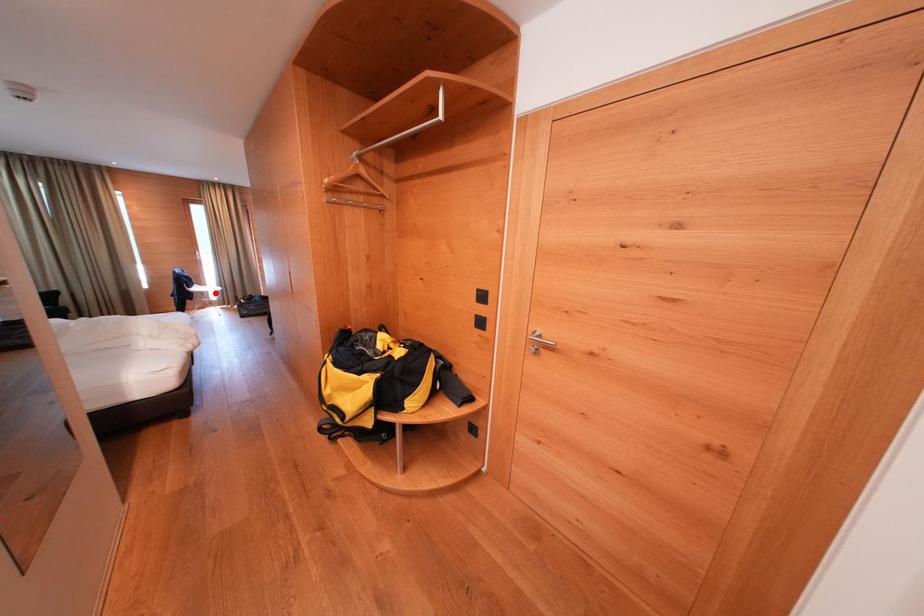
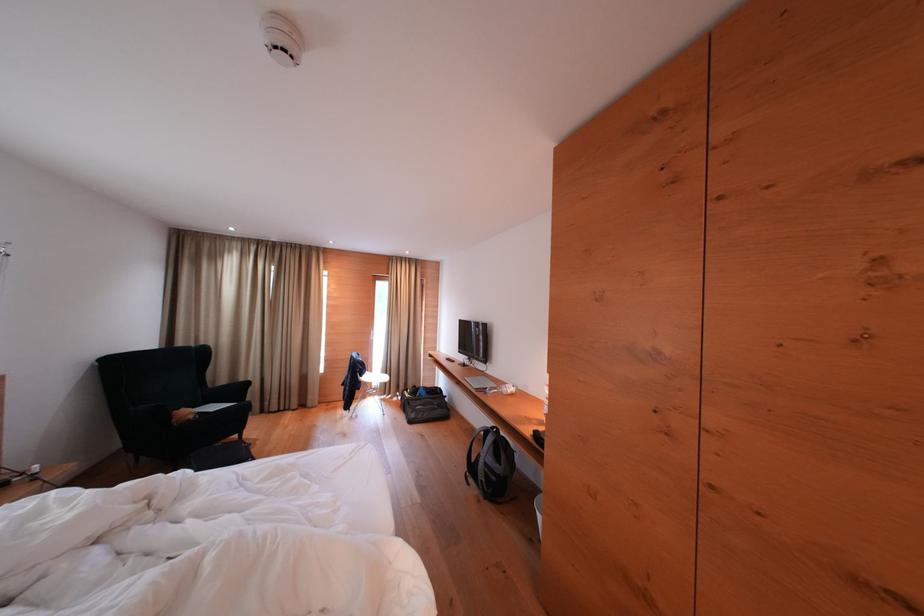
Question: I am providing you with two images of the same scene from different viewpoints. A red point is marked on the first image. At the location where the point appears in image 1, is it still visible in image 2?

Choices:
 (A) Yes
 (B) No

Answer: (A)